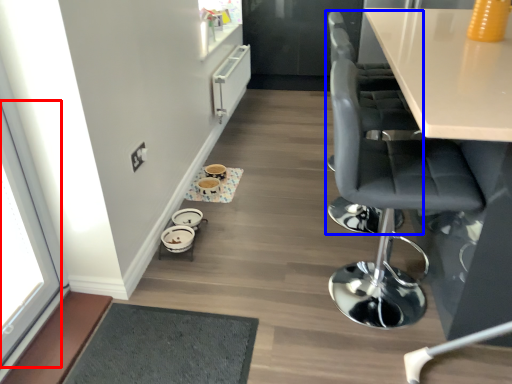
Question: Which of the following is the closest to the observer, window (highlighted by a red box) or chair (highlighted by a blue box)?

Choices:
 (A) window
 (B) chair

Answer: (A)